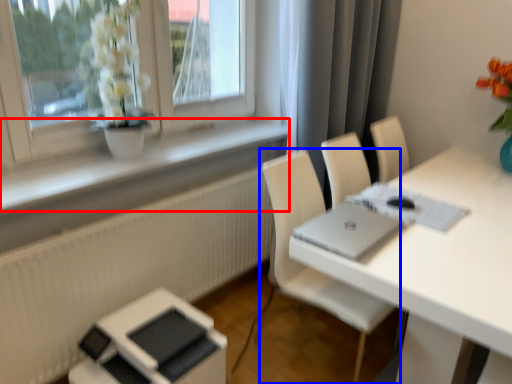
Question: Which object appears farthest to the camera in this image, window sill (highlighted by a red box) or chair (highlighted by a blue box)?

Choices:
 (A) window sill
 (B) chair

Answer: (B)